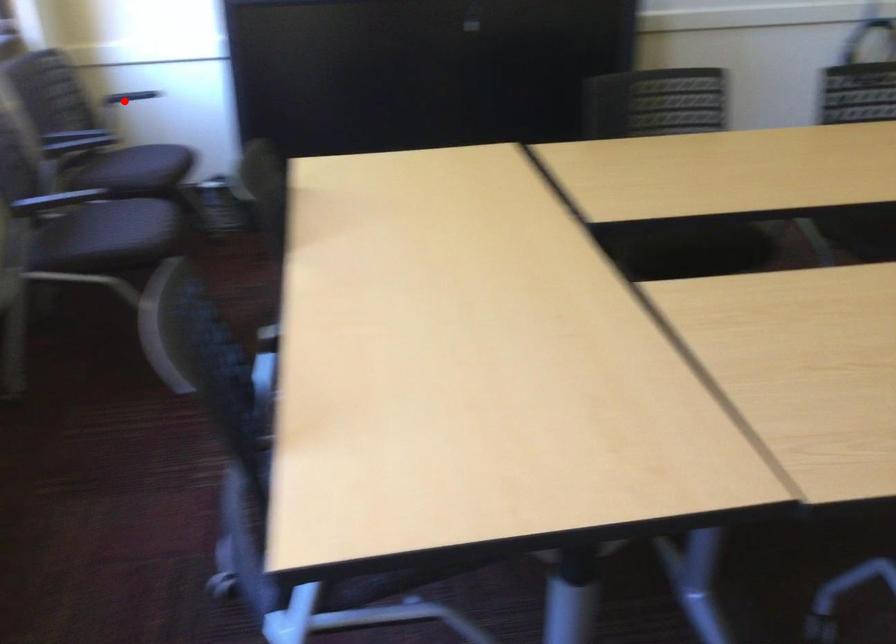
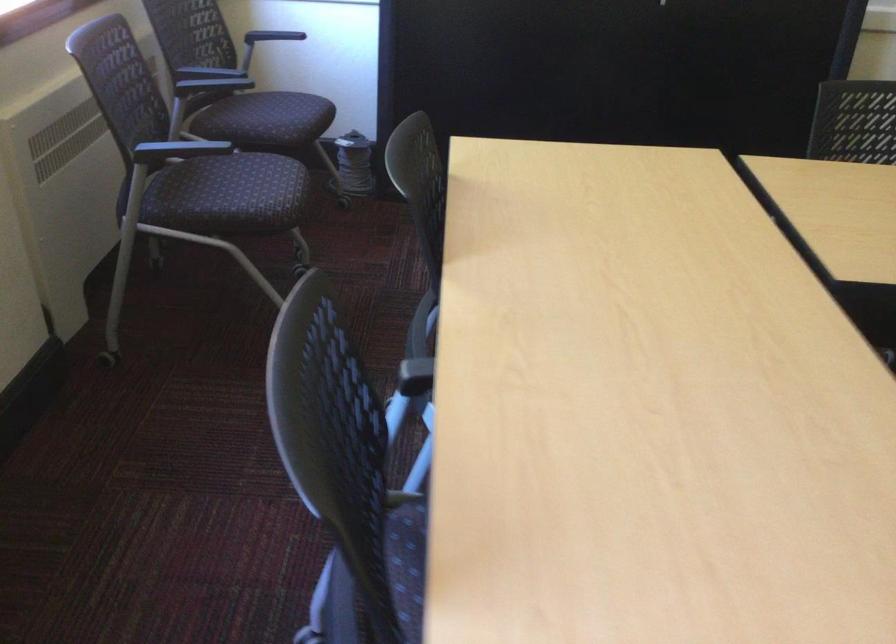
Find the pixel in the second image that matches the highlighted location in the first image.

(270, 38)